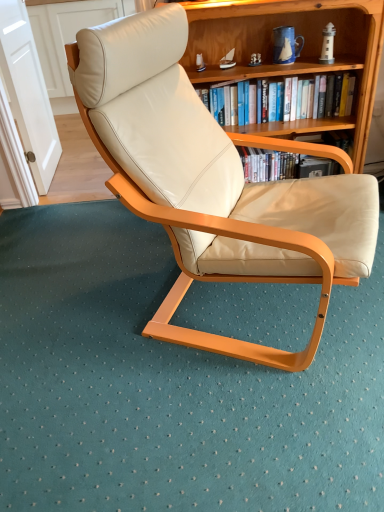
Question: Is matte cream leather chair at center positioned behind wooden bookshelf at upper center?

Choices:
 (A) yes
 (B) no

Answer: (B)

Question: From the image's perspective, is matte cream leather chair at center on top of wooden bookshelf at upper center?

Choices:
 (A) yes
 (B) no

Answer: (B)

Question: From a real-world perspective, is matte cream leather chair at center located beneath wooden bookshelf at upper center?

Choices:
 (A) yes
 (B) no

Answer: (B)

Question: Does matte cream leather chair at center come in front of wooden bookshelf at upper center?

Choices:
 (A) no
 (B) yes

Answer: (B)

Question: Is matte cream leather chair at center to the left of wooden bookshelf at upper center from the viewer's perspective?

Choices:
 (A) no
 (B) yes

Answer: (B)

Question: Is wooden bookshelf at upper center surrounded by matte cream leather chair at center?

Choices:
 (A) no
 (B) yes

Answer: (A)

Question: Does wooden bookshelf at upper center have a greater height compared to hardcover book at upper center?

Choices:
 (A) yes
 (B) no

Answer: (A)

Question: From the image's perspective, is wooden bookshelf at upper center on top of hardcover book at upper center?

Choices:
 (A) yes
 (B) no

Answer: (B)

Question: From the image's perspective, is wooden bookshelf at upper center below hardcover book at upper center?

Choices:
 (A) yes
 (B) no

Answer: (A)

Question: From a real-world perspective, is wooden bookshelf at upper center physically above hardcover book at upper center?

Choices:
 (A) no
 (B) yes

Answer: (A)

Question: Is wooden bookshelf at upper center bigger than hardcover book at upper center?

Choices:
 (A) no
 (B) yes

Answer: (B)

Question: Is the surface of wooden bookshelf at upper center in direct contact with hardcover book at upper center?

Choices:
 (A) yes
 (B) no

Answer: (B)

Question: Are wooden bookshelf at upper center and matte cream leather chair at center making contact?

Choices:
 (A) yes
 (B) no

Answer: (B)